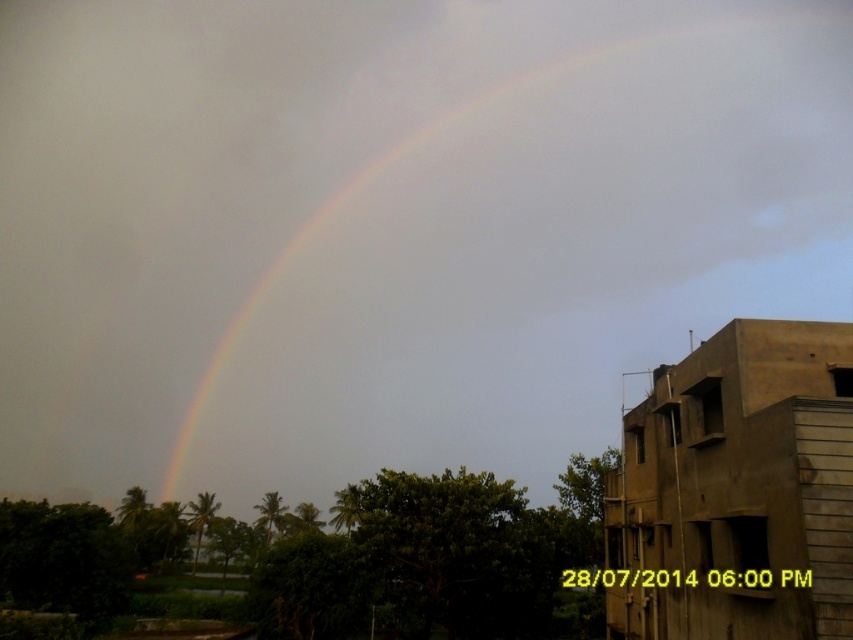
Question: Which of the following is the farthest from the observer?

Choices:
 (A) (833, 339)
 (B) (454, 253)

Answer: (B)

Question: Does rainbow at center have a smaller size compared to brown concrete building at right?

Choices:
 (A) yes
 (B) no

Answer: (B)

Question: Can you confirm if rainbow at center is positioned to the right of brown concrete building at right?

Choices:
 (A) yes
 (B) no

Answer: (A)

Question: Does rainbow at center appear over brown concrete building at right?

Choices:
 (A) yes
 (B) no

Answer: (A)

Question: Which point is farther to the camera?

Choices:
 (A) (524, 291)
 (B) (809, 509)

Answer: (A)